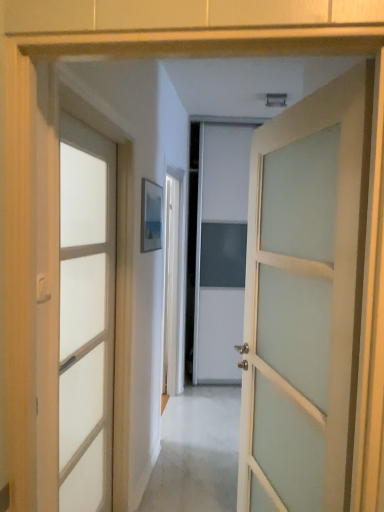
This screenshot has height=512, width=384. What are the coordinates of `white frosted glass door at center, positioned as the second door in left-to-right order` in the screenshot? It's located at (305, 298).

How much space does white frosted glass door at center, positioned as the second door in left-to-right order, occupy horizontally?

It is 4.38 inches.

This screenshot has height=512, width=384. What do you see at coordinates (305, 298) in the screenshot? I see `white frosted glass door at center, which is the 1th door in right-to-left order` at bounding box center [305, 298].

The image size is (384, 512). What do you see at coordinates (83, 316) in the screenshot?
I see `satin white door at left, marked as the second door in a right-to-left arrangement` at bounding box center [83, 316].

How much space does satin white door at left, marked as the second door in a right-to-left arrangement, occupy horizontally?

It is 2.14 inches.

Identify the location of satin white door at left, marked as the second door in a right-to-left arrangement. Image resolution: width=384 pixels, height=512 pixels. (83, 316).

This screenshot has height=512, width=384. I want to click on white frosted glass door at center, positioned as the second door in left-to-right order, so click(305, 298).

Between satin white door at left, marked as the second door in a right-to-left arrangement, and white frosted glass door at center, which is the 1th door in right-to-left order, which one appears on the right side from the viewer's perspective?

From the viewer's perspective, white frosted glass door at center, which is the 1th door in right-to-left order, appears more on the right side.

Which object is further away from the camera, satin white door at left, placed as the first door when sorted from left to right, or white frosted glass door at center, which is the 1th door in right-to-left order?

satin white door at left, placed as the first door when sorted from left to right.

Does point (106, 396) lie behind point (297, 158)?

That is True.

From the image's perspective, between satin white door at left, placed as the first door when sorted from left to right, and white frosted glass door at center, which is the 1th door in right-to-left order, who is located below?

satin white door at left, placed as the first door when sorted from left to right, appears lower in the image.

From the picture: From a real-world perspective, is satin white door at left, marked as the second door in a right-to-left arrangement, beneath white frosted glass door at center, which is the 1th door in right-to-left order?

Yes, from a real-world perspective, satin white door at left, marked as the second door in a right-to-left arrangement, is below white frosted glass door at center, which is the 1th door in right-to-left order.

Which object is wider, satin white door at left, marked as the second door in a right-to-left arrangement, or white frosted glass door at center, positioned as the second door in left-to-right order?

Wider between the two is white frosted glass door at center, positioned as the second door in left-to-right order.

Between satin white door at left, placed as the first door when sorted from left to right, and white frosted glass door at center, positioned as the second door in left-to-right order, which one has more height?

With more height is satin white door at left, placed as the first door when sorted from left to right.

Who is smaller, satin white door at left, marked as the second door in a right-to-left arrangement, or white frosted glass door at center, positioned as the second door in left-to-right order?

satin white door at left, marked as the second door in a right-to-left arrangement.

Would you say satin white door at left, marked as the second door in a right-to-left arrangement, is inside or outside white frosted glass door at center, positioned as the second door in left-to-right order?

satin white door at left, marked as the second door in a right-to-left arrangement, lies outside white frosted glass door at center, positioned as the second door in left-to-right order.

Is satin white door at left, placed as the first door when sorted from left to right, not close to white frosted glass door at center, which is the 1th door in right-to-left order?

No.

Is satin white door at left, marked as the second door in a right-to-left arrangement, positioned with its back to white frosted glass door at center, which is the 1th door in right-to-left order?

Yes, satin white door at left, marked as the second door in a right-to-left arrangement, is facing away from white frosted glass door at center, which is the 1th door in right-to-left order.

How different are the orientations of satin white door at left, placed as the first door when sorted from left to right, and white frosted glass door at center, positioned as the second door in left-to-right order, in degrees?

There is a 162-degree angle between the facing directions of satin white door at left, placed as the first door when sorted from left to right, and white frosted glass door at center, positioned as the second door in left-to-right order.

I want to click on door above the satin white door at left, marked as the second door in a right-to-left arrangement (from the image's perspective), so click(x=305, y=298).

Visually, is white frosted glass door at center, which is the 1th door in right-to-left order, positioned to the left or to the right of satin white door at left, placed as the first door when sorted from left to right?

In the image, white frosted glass door at center, which is the 1th door in right-to-left order, appears on the right side of satin white door at left, placed as the first door when sorted from left to right.

Is white frosted glass door at center, positioned as the second door in left-to-right order, further to the viewer compared to satin white door at left, placed as the first door when sorted from left to right?

No.

Considering the points (318, 91) and (99, 338), which point is in front, point (318, 91) or point (99, 338)?

The point (318, 91) is closer.

From the image's perspective, is white frosted glass door at center, which is the 1th door in right-to-left order, above or below satin white door at left, placed as the first door when sorted from left to right?

Clearly, from the image's perspective, white frosted glass door at center, which is the 1th door in right-to-left order, is above satin white door at left, placed as the first door when sorted from left to right.

From the picture: From a real-world perspective, is white frosted glass door at center, which is the 1th door in right-to-left order, positioned under satin white door at left, placed as the first door when sorted from left to right, based on gravity?

No, from a real-world perspective, white frosted glass door at center, which is the 1th door in right-to-left order, is not beneath satin white door at left, placed as the first door when sorted from left to right.

Considering the sizes of white frosted glass door at center, positioned as the second door in left-to-right order, and satin white door at left, placed as the first door when sorted from left to right, in the image, is white frosted glass door at center, positioned as the second door in left-to-right order, wider or thinner than satin white door at left, placed as the first door when sorted from left to right,?

white frosted glass door at center, positioned as the second door in left-to-right order, is wider than satin white door at left, placed as the first door when sorted from left to right.

Does white frosted glass door at center, positioned as the second door in left-to-right order, have a lesser height compared to satin white door at left, marked as the second door in a right-to-left arrangement?

Yes.

Considering the sizes of objects white frosted glass door at center, positioned as the second door in left-to-right order, and satin white door at left, placed as the first door when sorted from left to right, in the image provided, who is smaller, white frosted glass door at center, positioned as the second door in left-to-right order, or satin white door at left, placed as the first door when sorted from left to right,?

satin white door at left, placed as the first door when sorted from left to right.

Does white frosted glass door at center, positioned as the second door in left-to-right order, contain satin white door at left, marked as the second door in a right-to-left arrangement?

Definitely not — satin white door at left, marked as the second door in a right-to-left arrangement, is not inside white frosted glass door at center, positioned as the second door in left-to-right order.

Is white frosted glass door at center, positioned as the second door in left-to-right order, in contact with satin white door at left, placed as the first door when sorted from left to right?

No, white frosted glass door at center, positioned as the second door in left-to-right order, is not beside satin white door at left, placed as the first door when sorted from left to right.

Is white frosted glass door at center, which is the 1th door in right-to-left order, turned away from satin white door at left, marked as the second door in a right-to-left arrangement?

No.

In the image, there is a white frosted glass door at center, positioned as the second door in left-to-right order. Where is `door below it (from a real-world perspective)`? door below it (from a real-world perspective) is located at coordinates (83, 316).

Locate an element on the screen. This screenshot has height=512, width=384. door below the white frosted glass door at center, which is the 1th door in right-to-left order (from the image's perspective) is located at coordinates click(83, 316).

At what (x,y) coordinates should I click in order to perform the action: click on door on the right of satin white door at left, placed as the first door when sorted from left to right. Please return your answer as a coordinate pair (x, y). Looking at the image, I should click on (305, 298).